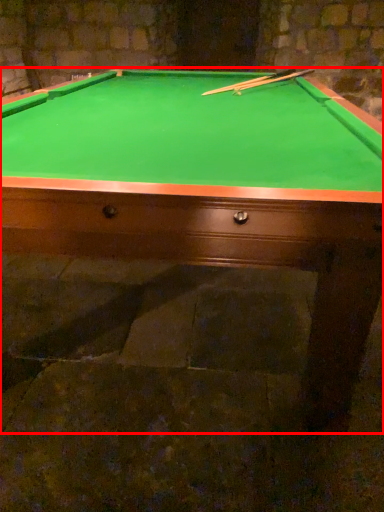
Question: In this image, where is billiard table (annotated by the red box) located relative to cue?

Choices:
 (A) left
 (B) right

Answer: (A)